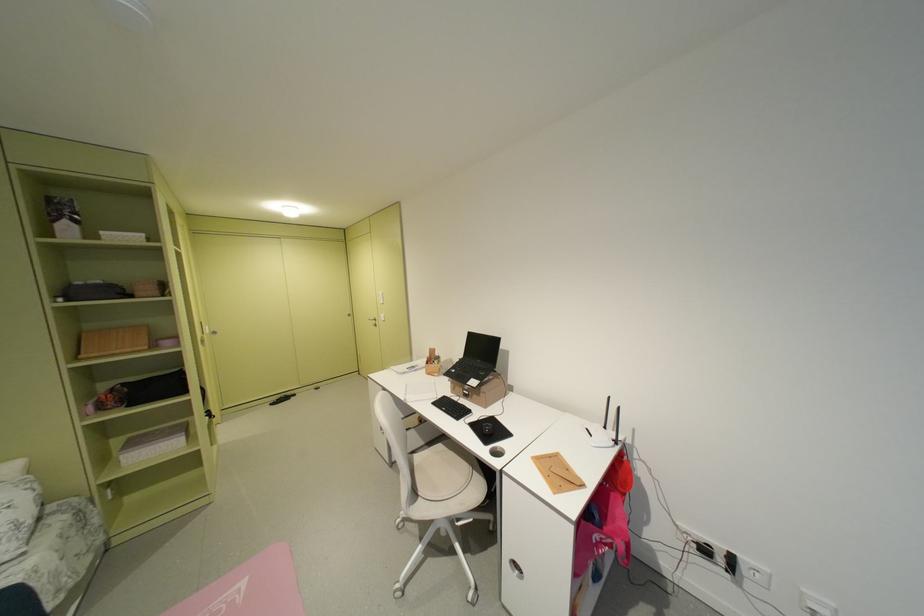
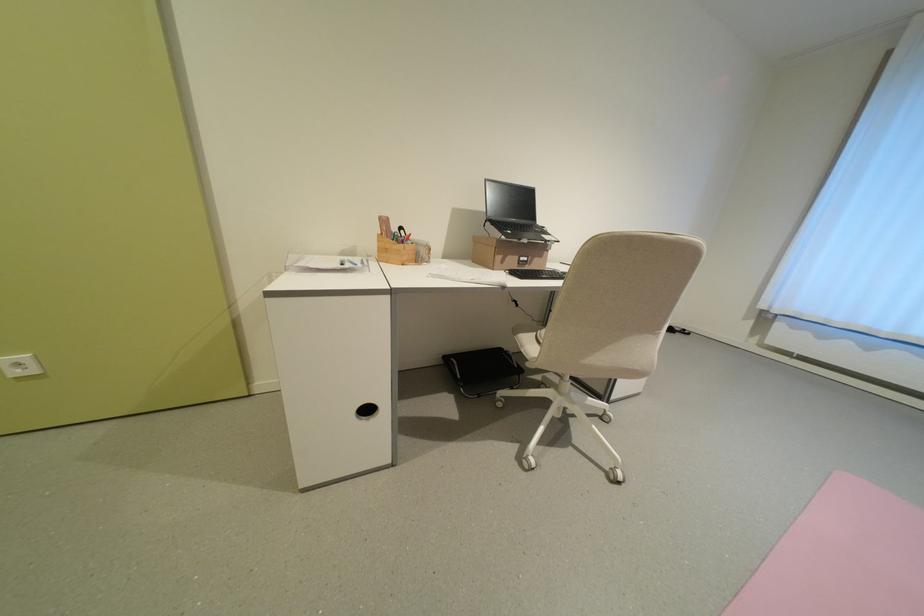
In the second image, find the point that corresponds to (463,371) in the first image.

(518, 233)